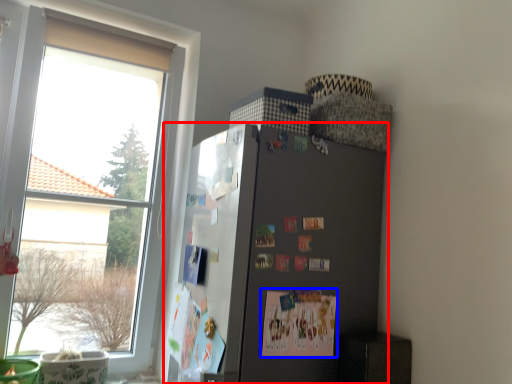
Question: Which object appears farthest to the camera in this image, refrigerator (highlighted by a red box) or postcard (highlighted by a blue box)?

Choices:
 (A) refrigerator
 (B) postcard

Answer: (B)